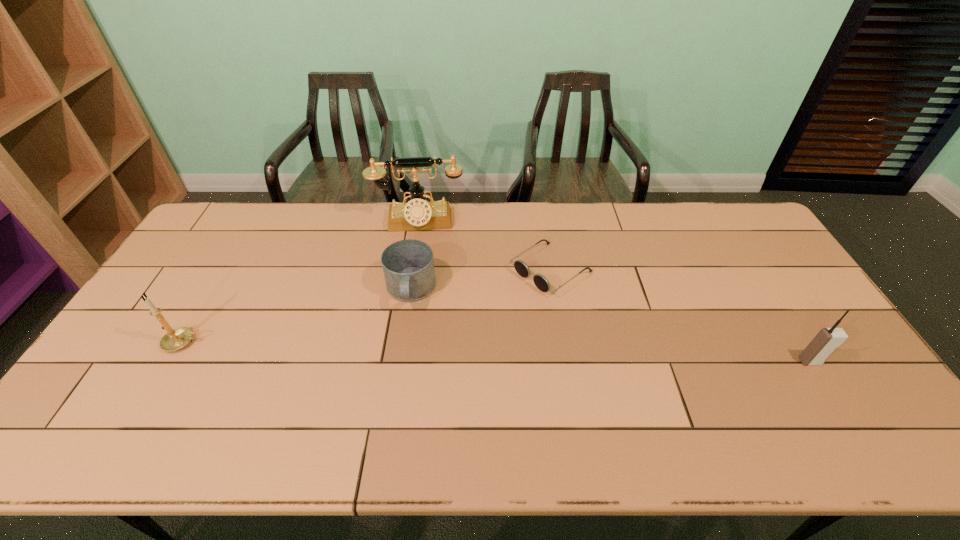
You are a GUI agent. You are given a task and a screenshot of the screen. Output one action in this format:
    pyautogui.click(x=<x>, y=<y>)
    Task: Click on the vacant area that lies between the second shortest object and the candle holder
    This screenshot has height=540, width=960.
    Given the screenshot: What is the action you would take?
    pyautogui.click(x=297, y=316)

The width and height of the screenshot is (960, 540). Find the location of `free space between the shortest object and the candle holder`. free space between the shortest object and the candle holder is located at coordinates (367, 306).

In order to click on free space between the rightmost object and the sunglasses in this screenshot , I will do coord(681,316).

The width and height of the screenshot is (960, 540). Identify the location of vacant point located between the fourth tallest object and the candle holder. (297, 316).

You are a GUI agent. You are given a task and a screenshot of the screen. Output one action in this format:
    pyautogui.click(x=<x>, y=<y>)
    Task: Click on the vacant space that's between the mug and the second nearest object
    This screenshot has width=960, height=540.
    Given the screenshot: What is the action you would take?
    pyautogui.click(x=297, y=316)

Image resolution: width=960 pixels, height=540 pixels. What are the coordinates of `empty space between the cellular telephone and the fourth tallest object` in the screenshot? It's located at (611, 326).

Identify the location of vacant space that is in between the nearest object and the candle holder. (496, 352).

Locate which object is the second closest to the cellular telephone. Please provide its 2D coordinates. Your answer should be formatted as a tuple, i.e. [(x, y)], where the tuple contains the x and y coordinates of a point satisfying the conditions above.

[(408, 265)]

Select which object appears as the second closest to the nearest object. Please provide its 2D coordinates. Your answer should be formatted as a tuple, i.e. [(x, y)], where the tuple contains the x and y coordinates of a point satisfying the conditions above.

[(408, 265)]